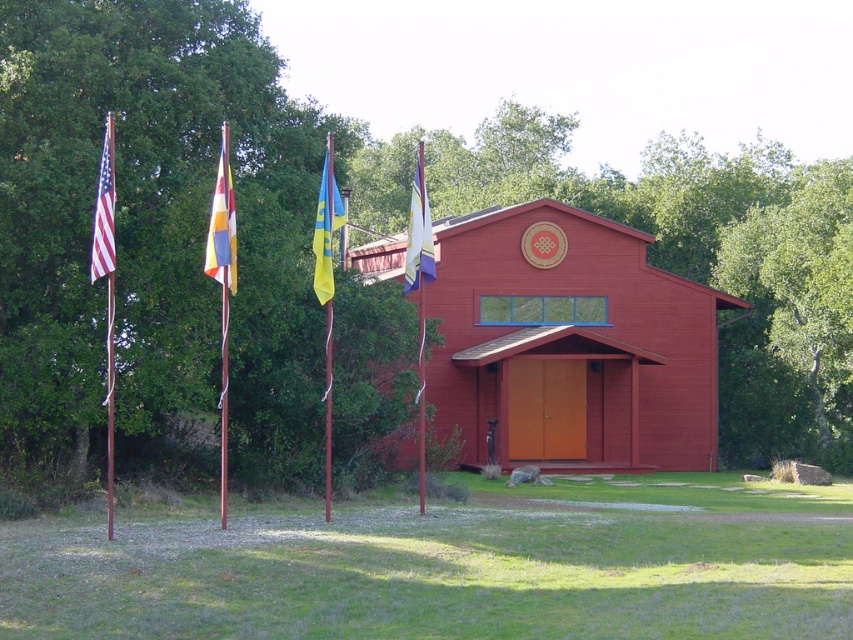
In the scene shown: You are a visitor standing in front of the red building. You notice the yellow fabric flag at center and the wooden flag pole at left. Which one is taller?

The yellow fabric flag at center is much taller than the wooden flag pole at left.

You are standing at the entrance of the vibrant red building and want to water the green leafy tree at left using a hose that can reach 20 meters. Can you reach the tree without moving the hose nozzle?

The distance between the green leafy tree at left and the viewer is 20.24 meters. Since the hose can only reach 20 meters, you cannot reach the tree without moving the hose nozzle.